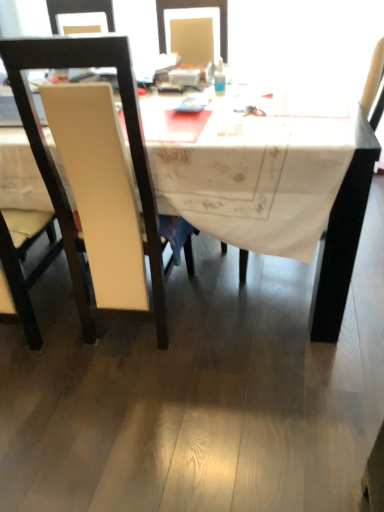
The width and height of the screenshot is (384, 512). What are the coordinates of `free space behind translucent plastic bottle at upper center` in the screenshot? It's located at (212, 82).